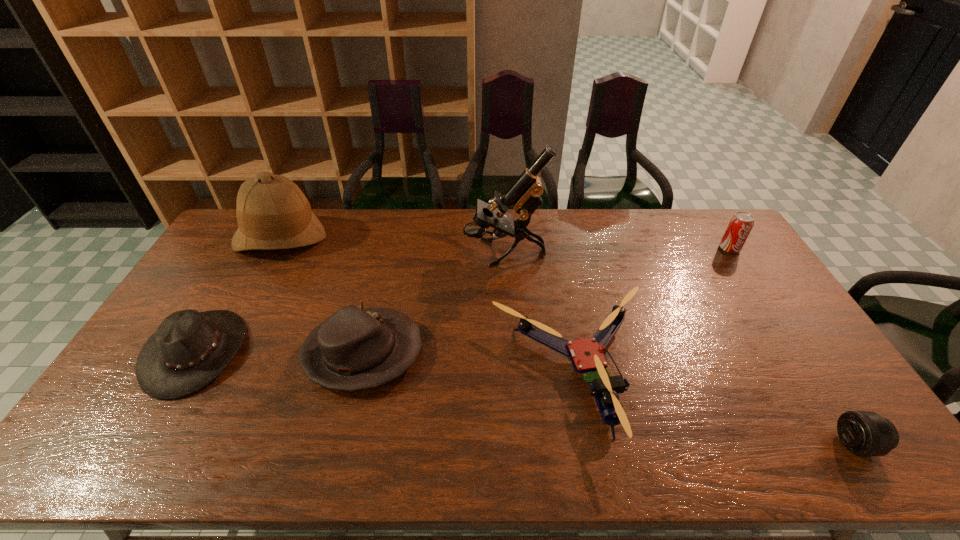
Find the location of a particular element. The image size is (960, 540). free region located 0.140m on the front-facing side of the farthest hat is located at coordinates (252, 289).

Find the location of a particular element. The width and height of the screenshot is (960, 540). free space located on the logo side of the soda can is located at coordinates (743, 270).

This screenshot has width=960, height=540. Find the location of `blank space located 0.100m on the decorative side of the fifth object from right to left`. blank space located 0.100m on the decorative side of the fifth object from right to left is located at coordinates (458, 353).

Locate an element on the screen. free space located on the back of the drone is located at coordinates (552, 253).

Where is `vacant space located on the front-facing side of the telephoto lens`? This screenshot has height=540, width=960. vacant space located on the front-facing side of the telephoto lens is located at coordinates (709, 444).

Find the location of a particular element. vacant region located 0.170m on the front-facing side of the telephoto lens is located at coordinates (767, 444).

The width and height of the screenshot is (960, 540). Identify the location of vacant space located on the front-facing side of the telephoto lens. (776, 444).

Identify the location of microscope positioned at the far edge. (524, 194).

Identify the location of hat that is at the far edge. This screenshot has height=540, width=960. (272, 212).

The image size is (960, 540). In order to click on soda can present at the far edge in this screenshot , I will do `click(740, 225)`.